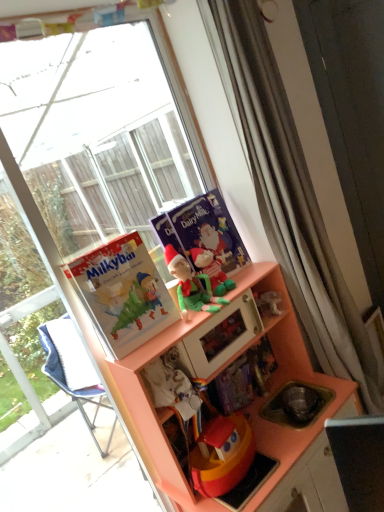
Image resolution: width=384 pixels, height=512 pixels. In order to click on multicolored paper book at center in this screenshot , I will do `click(243, 378)`.

Describe the element at coordinates (290, 197) in the screenshot. I see `white textured curtain at upper right` at that location.

Describe the element at coordinates (191, 285) in the screenshot. This screenshot has height=512, width=384. I see `green felt elf at center, which appears as the 2th toy when viewed from the back` at that location.

Identify the location of green plush toy at center, which is the first toy from back to front. (212, 270).

From a real-world perspective, is green fabric elf at upper center above or below white textured curtain at upper right?

green fabric elf at upper center is situated lower than white textured curtain at upper right in the real world.

Looking at the image, does green fabric elf at upper center seem bigger or smaller compared to white textured curtain at upper right?

Considering their sizes, green fabric elf at upper center takes up less space than white textured curtain at upper right.

Is green fabric elf at upper center taller than white textured curtain at upper right?

In fact, green fabric elf at upper center may be shorter than white textured curtain at upper right.

Identify the location of curtain lying in front of the green fabric elf at upper center. (290, 197).

Is transparent glass window at upper left at the back of green felt elf at center, which appears as the 2th toy when viewed from the back?

Correct, green felt elf at center, which appears as the 2th toy when viewed from the back, is looking away from transparent glass window at upper left.

Who is shorter, green felt elf at center, which ranks as the 1th toy in front-to-back order, or transparent glass window at upper left?

Standing shorter between the two is green felt elf at center, which ranks as the 1th toy in front-to-back order.

Find the location of a particular element. The width and height of the screenshot is (384, 512). toy that is the 1st object located above the transparent glass window at upper left (from the image's perspective) is located at coordinates (191, 285).

Is green felt elf at center, which appears as the 2th toy when viewed from the back, completely or partially outside of transparent glass window at upper left?

Yes, green felt elf at center, which appears as the 2th toy when viewed from the back, is not within transparent glass window at upper left.

Is green felt elf at center, which ranks as the 1th toy in front-to-back order, positioned with its back to matte orange cabinet at center?

No.

Starting from the matte orange cabinet at center, which toy is the 1st one behind? Please provide its 2D coordinates.

[(191, 285)]

Are green felt elf at center, which ranks as the 1th toy in front-to-back order, and matte orange cabinet at center beside each other?

No, green felt elf at center, which ranks as the 1th toy in front-to-back order, is not next to matte orange cabinet at center.

Which of these two, green felt elf at center, which appears as the 2th toy when viewed from the back, or matte orange cabinet at center, is wider?

matte orange cabinet at center.

Is there a large distance between transparent glass window at upper left and matte orange cabinet at center?

Absolutely, transparent glass window at upper left is distant from matte orange cabinet at center.

Considering the sizes of transparent glass window at upper left and matte orange cabinet at center in the image, is transparent glass window at upper left taller or shorter than matte orange cabinet at center?

In the image, transparent glass window at upper left appears to be taller than matte orange cabinet at center.

Can you confirm if transparent glass window at upper left is positioned to the right of matte orange cabinet at center?

In fact, transparent glass window at upper left is to the left of matte orange cabinet at center.

Which is correct: transparent glass window at upper left is inside matte orange cabinet at center, or outside of it?

The correct answer is: outside.

Find the location of `toy that is the 1st one when counting downward from the matte purple comic book at center, which is the second comic book from front to back (from the image's perspective)`. toy that is the 1st one when counting downward from the matte purple comic book at center, which is the second comic book from front to back (from the image's perspective) is located at coordinates (212, 270).

From the image's perspective, would you say matte purple comic book at center, which is the second comic book from front to back, is shown under green plush toy at center, the second toy viewed from the front?

No.

Is matte purple comic book at center, positioned as the 1th comic book in back-to-front order, looking in the opposite direction of green plush toy at center, which is the first toy from back to front?

Yes.

Which of these two, matte orange cabinet at center or multicolored paper book at center, stands shorter?

multicolored paper book at center.

Based on the photo, is matte orange cabinet at center in contact with multicolored paper book at center?

No.

I want to click on cabinetry below the multicolored paper book at center (from a real-world perspective), so point(238,409).

How far apart are matte orange cabinet at center and multicolored paper book at center?

matte orange cabinet at center is 20.00 centimeters away from multicolored paper book at center.

Which object is wider, transparent glass window at upper left or white textured curtain at upper right?

With larger width is white textured curtain at upper right.

Could you tell me if transparent glass window at upper left is turned towards white textured curtain at upper right?

Yes, transparent glass window at upper left is aimed at white textured curtain at upper right.

Is transparent glass window at upper left not near white textured curtain at upper right?

Yes.

Can you tell me how much transparent glass window at upper left and white textured curtain at upper right differ in facing direction?

0.000433 degrees separate the facing orientations of transparent glass window at upper left and white textured curtain at upper right.

This screenshot has height=512, width=384. What are the coordinates of `curtain that is on the right side of green fabric elf at upper center` in the screenshot? It's located at (290, 197).

Locate an element on the screen. window lying below the green felt elf at center, which appears as the 2th toy when viewed from the back (from the image's perspective) is located at coordinates (86, 172).

Considering their positions, is matte paper comic book at left, the 1th comic book when ordered from front to back, positioned further to green fabric elf at upper center than green felt elf at center, which appears as the 2th toy when viewed from the back?

Among the two, matte paper comic book at left, the 1th comic book when ordered from front to back, is located further to green fabric elf at upper center.

Estimate the real-world distances between objects in this image. Which object is further from matte purple comic book at center, which is the second comic book from front to back, green plush toy at center, which is the first toy from back to front, or white textured curtain at upper right?

Based on the image, white textured curtain at upper right appears to be further to matte purple comic book at center, which is the second comic book from front to back.

When comparing their distances from green plush toy at center, which is the first toy from back to front, does transparent glass window at upper left or multicolored paper book at center seem further?

The object further to green plush toy at center, which is the first toy from back to front, is transparent glass window at upper left.

Which object lies nearer to the anchor point transparent glass window at upper left, matte orange cabinet at center or matte paper comic book at left, positioned as the second comic book in back-to-front order?

The object closer to transparent glass window at upper left is matte paper comic book at left, positioned as the second comic book in back-to-front order.

When comparing their distances from multicolored paper book at center, does transparent glass window at upper left or matte orange cabinet at center seem further?

Based on the image, transparent glass window at upper left appears to be further to multicolored paper book at center.

Considering their positions, is matte orange cabinet at center positioned closer to green fabric elf at upper center than multicolored paper book at center?

matte orange cabinet at center is positioned closer to the anchor green fabric elf at upper center.

From the image, which object appears to be farther from matte paper comic book at left, positioned as the second comic book in back-to-front order, matte purple comic book at center, positioned as the 1th comic book in back-to-front order, or green felt elf at center, which ranks as the 1th toy in front-to-back order?

Based on the image, matte purple comic book at center, positioned as the 1th comic book in back-to-front order, appears to be further to matte paper comic book at left, positioned as the second comic book in back-to-front order.

Based on their spatial positions, is matte paper comic book at left, positioned as the second comic book in back-to-front order, or white textured curtain at upper right closer to matte purple comic book at center, which is the second comic book from front to back?

matte paper comic book at left, positioned as the second comic book in back-to-front order, is closer to matte purple comic book at center, which is the second comic book from front to back.

Where is `comic book between matte purple comic book at center, which is the second comic book from front to back, and green fabric elf at upper center vertically`? comic book between matte purple comic book at center, which is the second comic book from front to back, and green fabric elf at upper center vertically is located at coordinates (122, 293).

The width and height of the screenshot is (384, 512). In order to click on window between matte paper comic book at left, positioned as the second comic book in back-to-front order, and matte orange cabinet at center in the up-down direction in this screenshot , I will do `click(86, 172)`.

You are a GUI agent. You are given a task and a screenshot of the screen. Output one action in this format:
    pyautogui.click(x=<x>, y=<y>)
    Task: Click on the appliance that lies between matte paper comic book at left, the 1th comic book when ordered from front to back, and matte orange cabinet at center from top to bottom
    The image size is (384, 512).
    Given the screenshot: What is the action you would take?
    pyautogui.click(x=223, y=335)

Find the location of `comic book situated between matte paper comic book at left, the 1th comic book when ordered from front to back, and green plush toy at center, which is the first toy from back to front, from left to right`. comic book situated between matte paper comic book at left, the 1th comic book when ordered from front to back, and green plush toy at center, which is the first toy from back to front, from left to right is located at coordinates (204, 234).